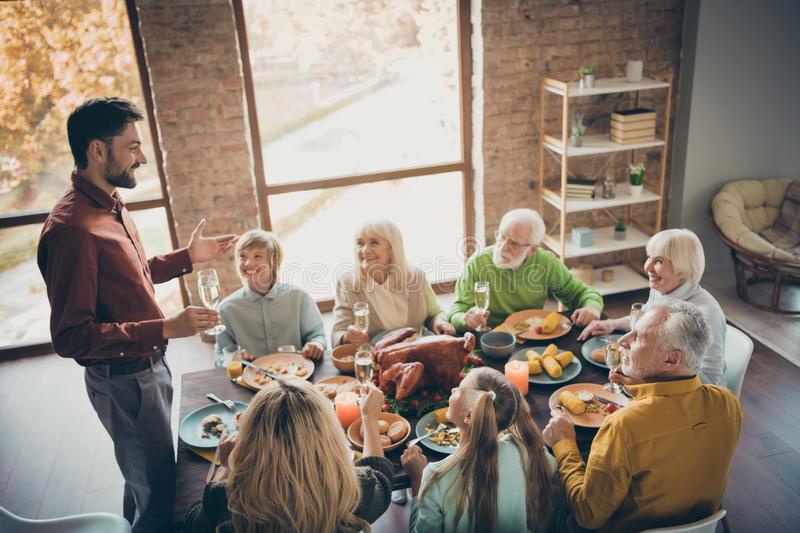
The height and width of the screenshot is (533, 800). Find the location of `drink glasses`. drink glasses is located at coordinates (214, 296), (233, 355), (358, 319), (362, 363), (478, 298), (610, 351), (629, 311).